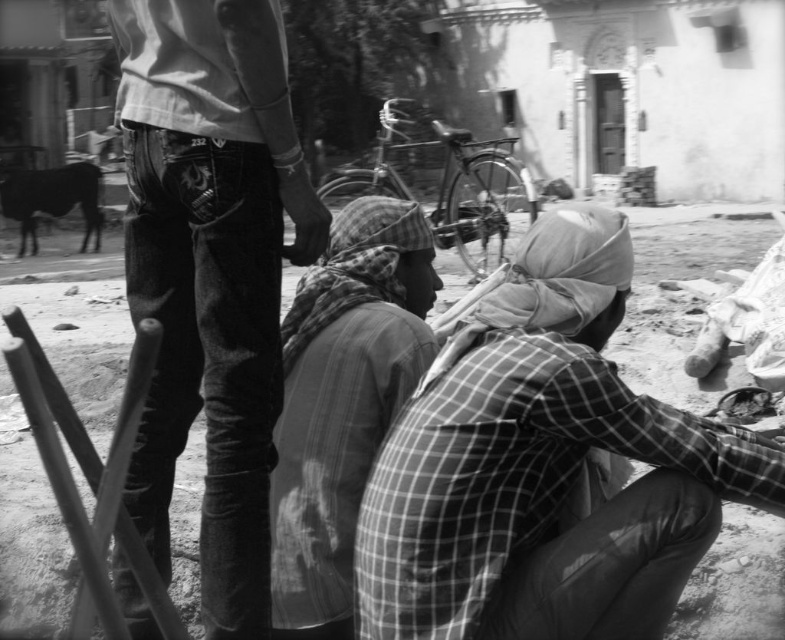
Does jeans at center come behind checkered fabric headscarf at center?

No, jeans at center is closer to the viewer.

Which is in front, point (236, 621) or point (296, 452)?

Point (236, 621) is more forward.

At what (x,y) coordinates should I click in order to perform the action: click on jeans at center. Please return your answer as a coordinate pair (x, y). Image resolution: width=785 pixels, height=640 pixels. Looking at the image, I should click on (210, 273).

Can you confirm if checkered fabric headscarf at lower center is thinner than checkered fabric headscarf at center?

In fact, checkered fabric headscarf at lower center might be wider than checkered fabric headscarf at center.

Can you confirm if checkered fabric headscarf at lower center is shorter than checkered fabric headscarf at center?

Correct, checkered fabric headscarf at lower center is not as tall as checkered fabric headscarf at center.

Where is `checkered fabric headscarf at lower center`? This screenshot has width=785, height=640. checkered fabric headscarf at lower center is located at coordinates (543, 467).

Is checkered fabric headscarf at lower center bigger than jeans at center?

Actually, checkered fabric headscarf at lower center might be smaller than jeans at center.

Can you confirm if checkered fabric headscarf at lower center is shorter than jeans at center?

Yes, checkered fabric headscarf at lower center is shorter than jeans at center.

At what (x,y) coordinates should I click in order to perform the action: click on checkered fabric headscarf at lower center. Please return your answer as a coordinate pair (x, y). This screenshot has height=640, width=785. Looking at the image, I should click on point(543,467).

This screenshot has height=640, width=785. Find the location of `checkered fabric headscarf at lower center`. checkered fabric headscarf at lower center is located at coordinates (543, 467).